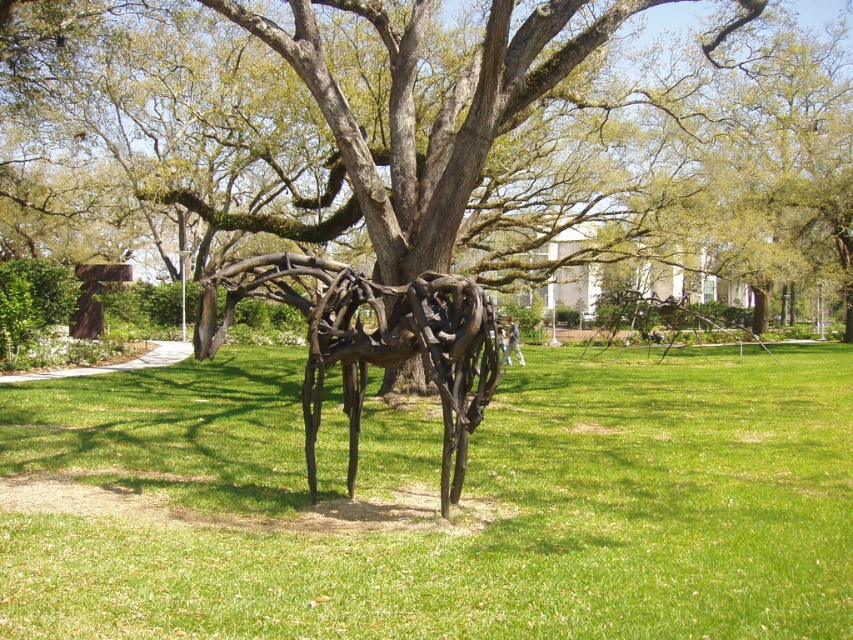
You are planning to place a small garden ornament that requires a 30 cm wide space. You see the green grass at center and the rustic metal spider at center. Which area can accommodate the ornament?

The green grass at center might be wider than rustic metal spider at center, so the green grass at center is more likely to accommodate the ornament if it requires a 30 cm wide space.

You are standing in the park and see two points marked in the image. Which point, point [699,586] or point [316,358], is nearer to you?

Point [699,586] is closer to the viewer than point [316,358].